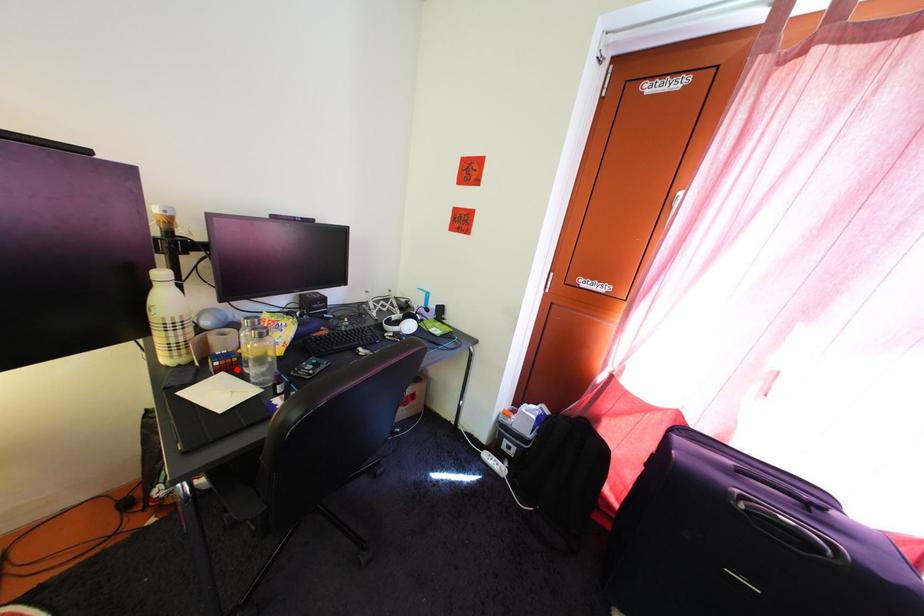
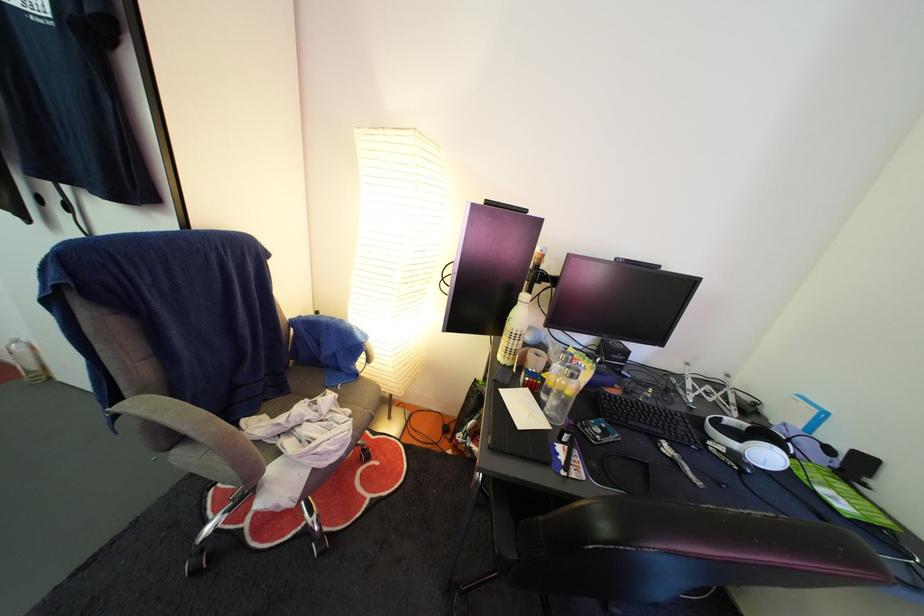
Where in the second image is the point corresponding to the highlighted location from the first image?

(543, 390)